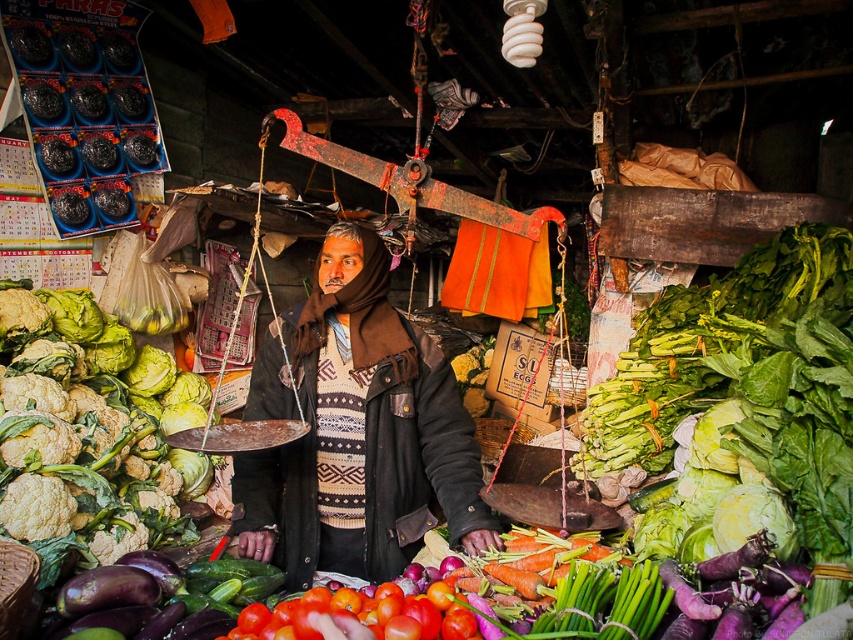
Question: Which of these objects is positioned closest to the green leafy cauliflower at left?

Choices:
 (A) shiny red tomatoes at center
 (B) green leafy cabbage at center

Answer: (A)

Question: Which point appears farthest from the camera in this image?

Choices:
 (A) (413, 529)
 (B) (86, 538)
 (C) (311, 636)

Answer: (B)

Question: Which point appears closest to the camera in this image?

Choices:
 (A) (378, 499)
 (B) (131, 468)
 (C) (380, 605)

Answer: (C)

Question: Does green leafy cauliflower at left have a larger size compared to shiny red tomatoes at center?

Choices:
 (A) no
 (B) yes

Answer: (B)

Question: Can you confirm if shiny red tomatoes at center is smaller than green leafy cabbage at center?

Choices:
 (A) yes
 (B) no

Answer: (B)

Question: From the image, what is the correct spatial relationship of brown woolen scarf at center in relation to green leafy cabbage at center?

Choices:
 (A) above
 (B) below

Answer: (A)